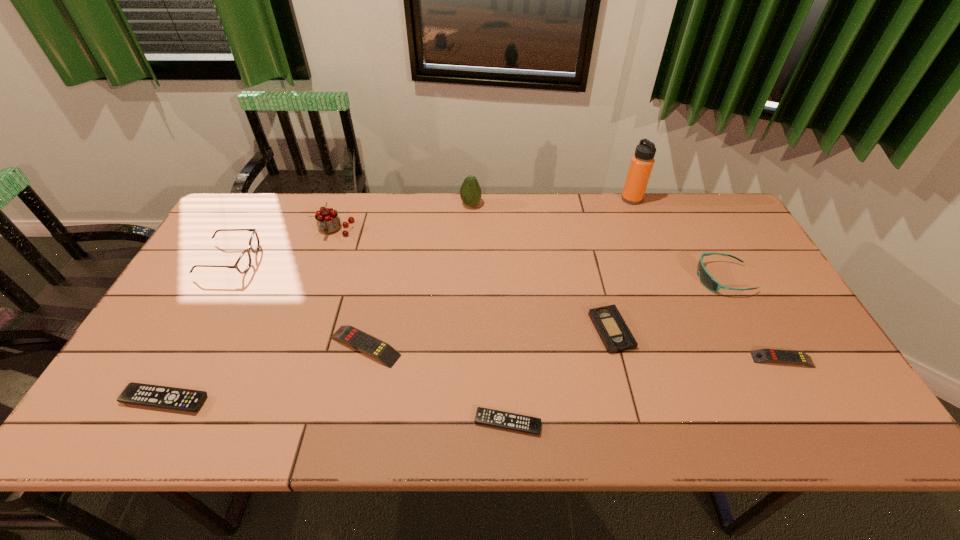
At what (x,y) coordinates should I click in order to perform the action: click on free space between the leftmost remote control and the thermos bottle. Please return your answer as a coordinate pair (x, y). Looking at the image, I should click on (398, 299).

Locate an element on the screen. object that ranks as the closest to the smaller yellow remote control is located at coordinates (706, 279).

Identify which object is located as the third nearest to the seventh object from right to left. Please provide its 2D coordinates. Your answer should be formatted as a tuple, i.e. [(x, y)], where the tuple contains the x and y coordinates of a point satisfying the conditions above.

[(328, 221)]

At what (x,y) coordinates should I click in order to perform the action: click on remote control object that ranks as the third closest to the third object from left to right. Please return your answer as a coordinate pair (x, y). The width and height of the screenshot is (960, 540). Looking at the image, I should click on (522, 423).

Identify the location of the third closest remote control to the fourth object from right to left. click(x=353, y=337).

The image size is (960, 540). What are the coordinates of `free space in the image that satisfies the following two spatial constraints: 1. on the front-facing side of the spectacles; 2. on the right side of the bigger black remote control` in the screenshot? It's located at (150, 400).

Find the location of a particular element. The width and height of the screenshot is (960, 540). vacant area that satisfies the following two spatial constraints: 1. on the handle side of the fourth object from right to left; 2. on the left side of the red cherry is located at coordinates (300, 330).

Locate an element on the screen. blank area in the image that satisfies the following two spatial constraints: 1. on the handle side of the red cherry; 2. on the right side of the right black remote control is located at coordinates (268, 423).

The width and height of the screenshot is (960, 540). I want to click on vacant space that satisfies the following two spatial constraints: 1. on the front side of the smaller yellow remote control; 2. on the right side of the avocado, so click(x=468, y=360).

Where is `blank space that satisfies the following two spatial constraints: 1. on the handle side of the bigger yellow remote control; 2. on the left side of the third object from left to right`? The height and width of the screenshot is (540, 960). blank space that satisfies the following two spatial constraints: 1. on the handle side of the bigger yellow remote control; 2. on the left side of the third object from left to right is located at coordinates (295, 346).